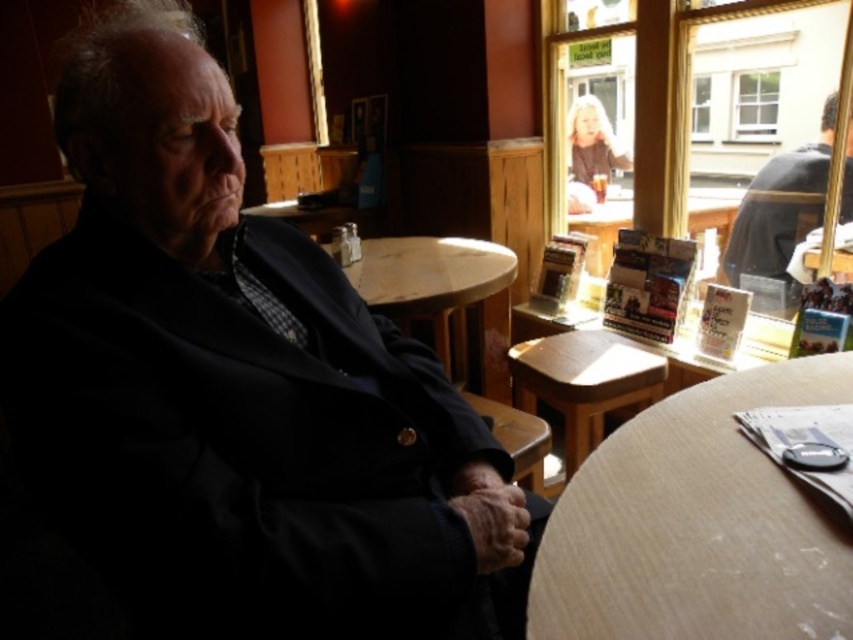
Question: Considering the real-world distances, which object is closest to the matte black jacket at left?

Choices:
 (A) wooden table at upper center
 (B) marble table at center

Answer: (B)

Question: Is matte black jacket at left bigger than wooden table at upper center?

Choices:
 (A) yes
 (B) no

Answer: (A)

Question: Is dark gray jacket at upper right to the right of wooden table at upper center from the viewer's perspective?

Choices:
 (A) yes
 (B) no

Answer: (A)

Question: Does wooden at lower right come in front of dark gray jacket at upper right?

Choices:
 (A) yes
 (B) no

Answer: (A)

Question: Which point is farther from the camera taking this photo?

Choices:
 (A) (730, 209)
 (B) (834, 561)
 (C) (312, 278)
 (D) (450, 353)

Answer: (D)

Question: Which of these objects is positioned closest to the matte black jacket at left?

Choices:
 (A) wooden table at upper center
 (B) dark gray jacket at upper right
 (C) marble table at center
 (D) wooden at lower right

Answer: (D)